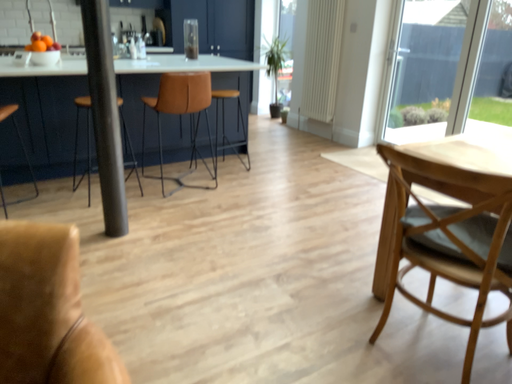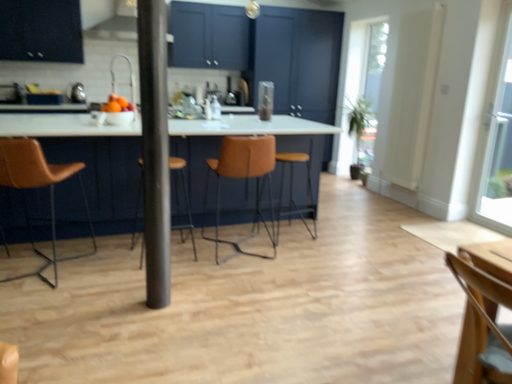
Question: Which way did the camera rotate in the video?

Choices:
 (A) rotated right
 (B) rotated left

Answer: (B)